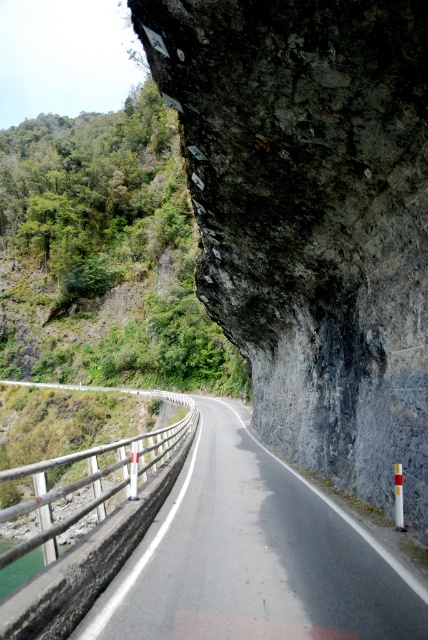
Question: Which object is closer to the camera taking this photo?

Choices:
 (A) green leafy hillside at upper left
 (B) asphalt road at center

Answer: (B)

Question: Is green leafy hillside at upper left to the left of asphalt road at center from the viewer's perspective?

Choices:
 (A) no
 (B) yes

Answer: (B)

Question: Does green leafy hillside at upper left have a greater width compared to asphalt road at center?

Choices:
 (A) no
 (B) yes

Answer: (B)

Question: Which object appears farthest from the camera in this image?

Choices:
 (A) asphalt road at center
 (B) green leafy hillside at upper left

Answer: (B)

Question: Does green leafy hillside at upper left have a greater width compared to asphalt road at center?

Choices:
 (A) no
 (B) yes

Answer: (B)